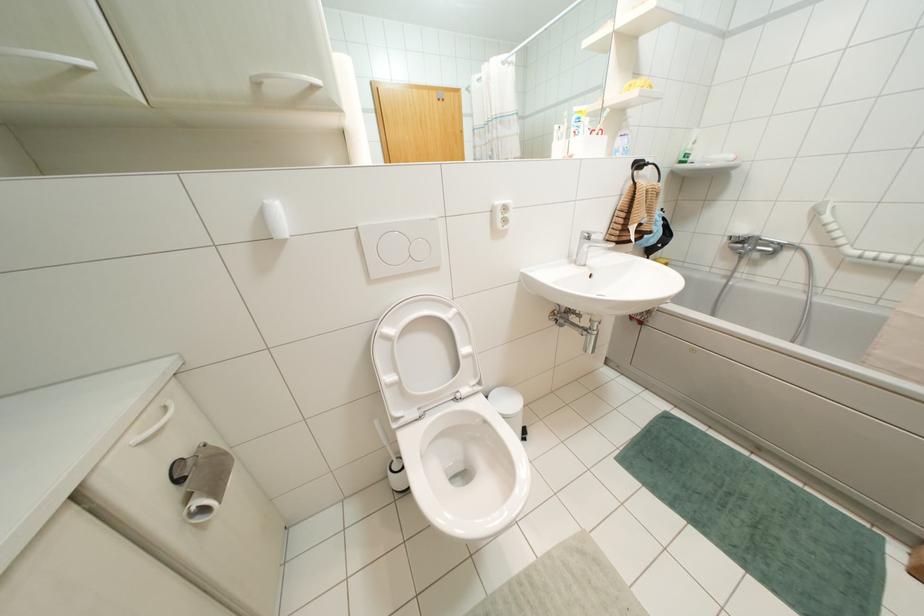
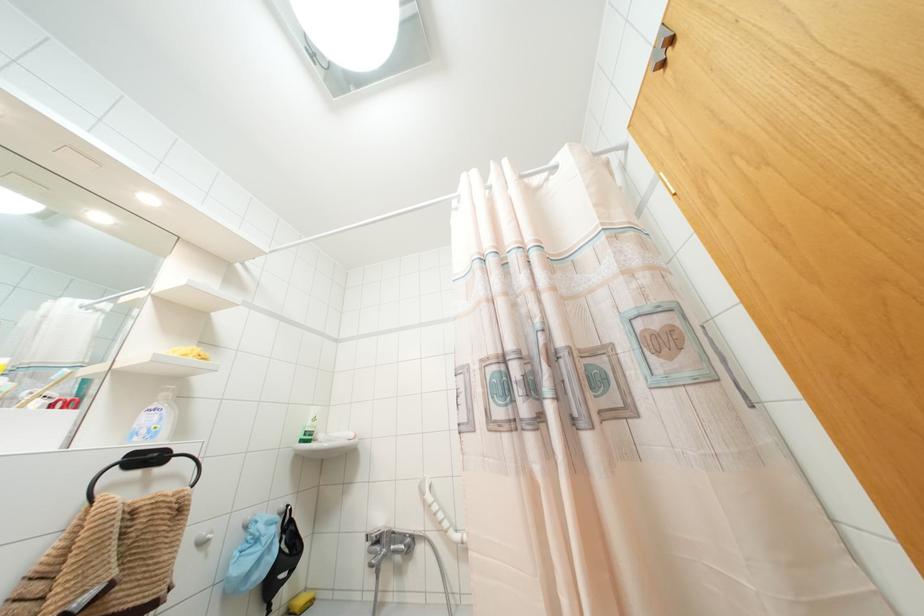
The point at (638, 164) is marked in the first image. Where is the corresponding point in the second image?

(147, 458)